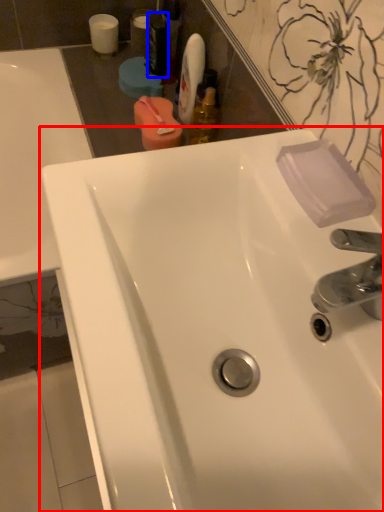
Question: Which object is further to the camera taking this photo, sink (highlighted by a red box) or mouthwash (highlighted by a blue box)?

Choices:
 (A) sink
 (B) mouthwash

Answer: (B)